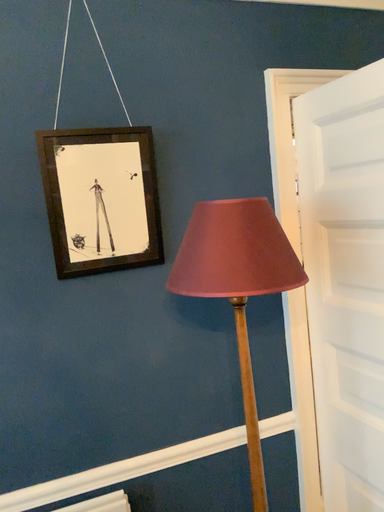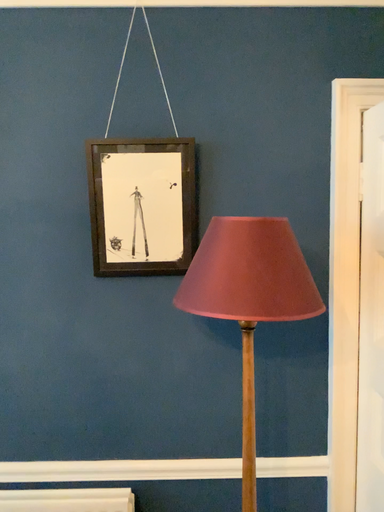
Question: How did the camera likely rotate when shooting the video?

Choices:
 (A) rotated left
 (B) rotated right

Answer: (A)